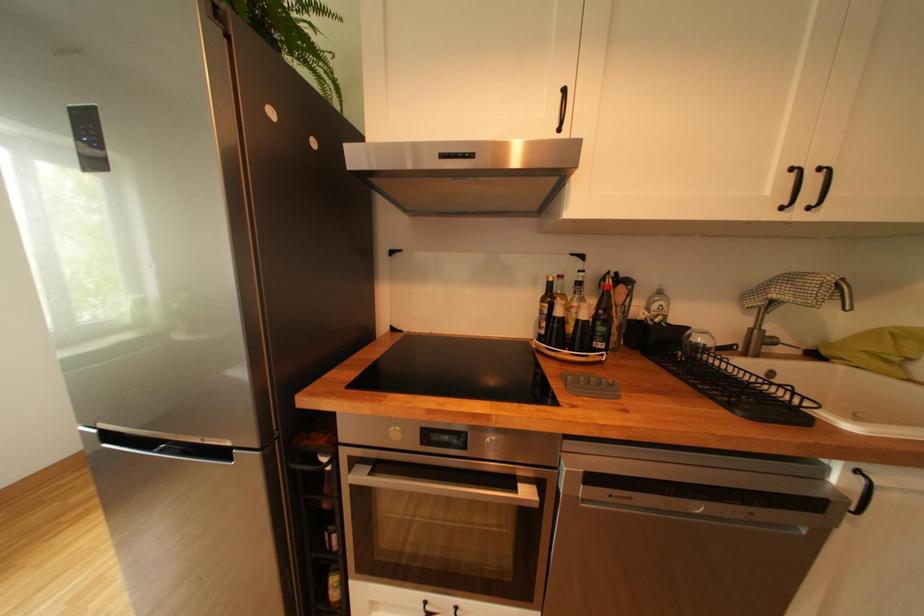
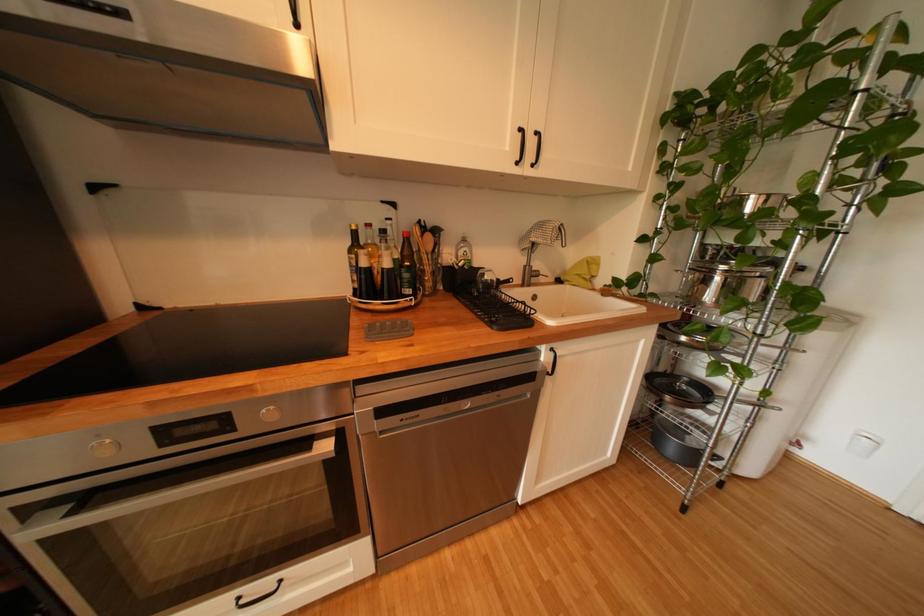
Question: The camera is either moving clockwise (left) or counter-clockwise (right) around the object. The first image is from the beginning of the video and the second image is from the end. Is the camera moving left or right when shooting the video?

Choices:
 (A) Left
 (B) Right

Answer: (A)